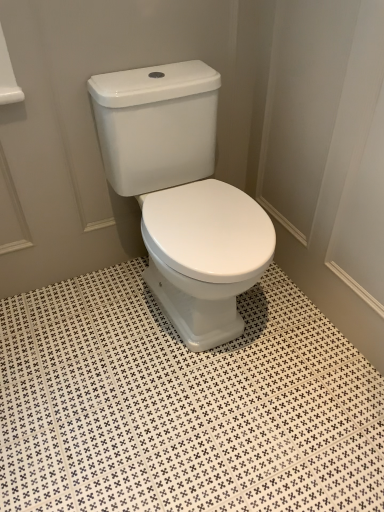
In order to click on free spot to the right of white glossy toilet at center in this screenshot , I will do `click(302, 335)`.